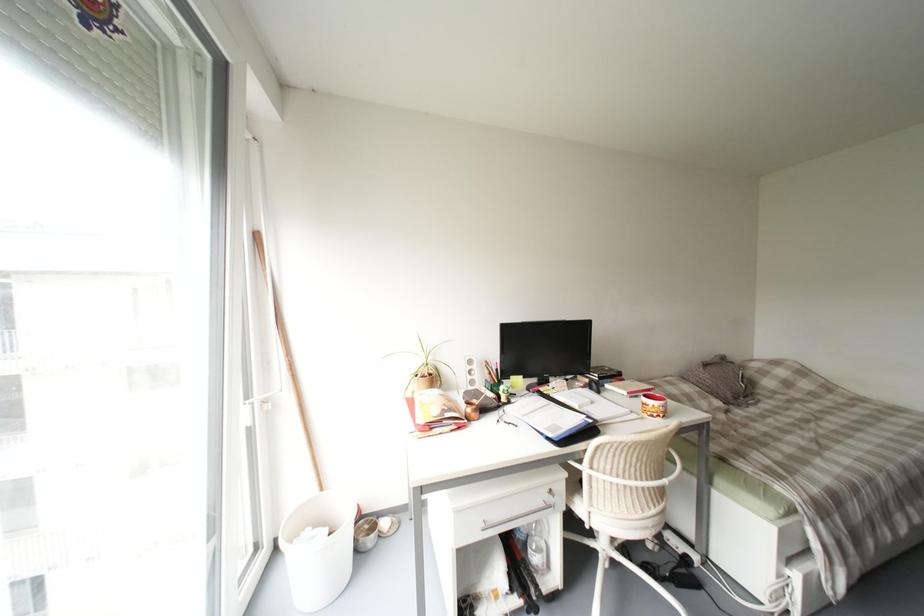
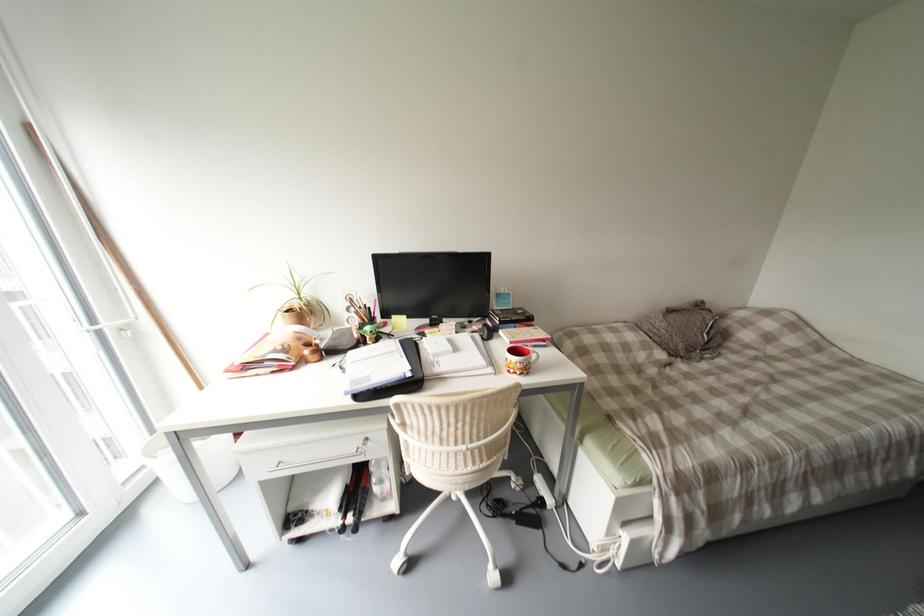
Which direction would the cameraman need to move to produce the second image?

The movement direction of the cameraman is right, forward.